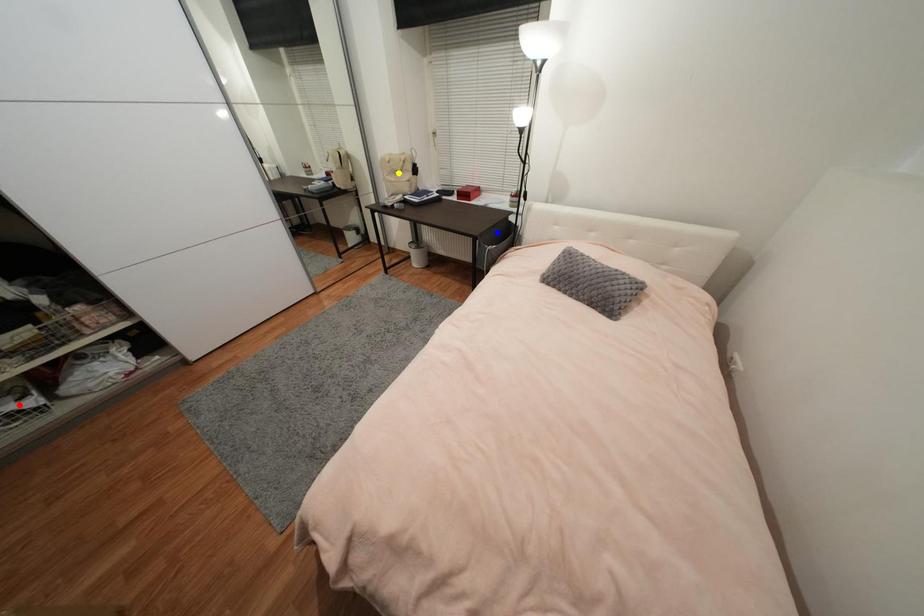
Order these from nearest to farthest:
- red point
- blue point
- yellow point

1. red point
2. blue point
3. yellow point